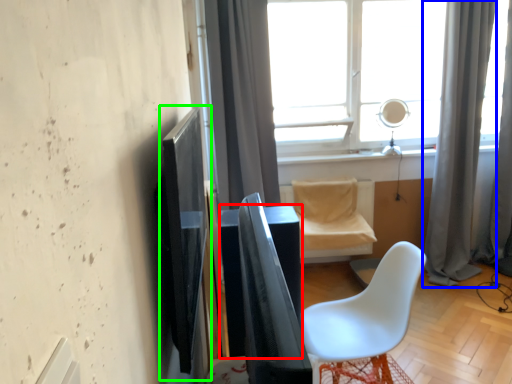
Question: Which is nearer to the table (highlighted by a red box)? curtain (highlighted by a blue box) or screen door (highlighted by a green box).

Choices:
 (A) curtain
 (B) screen door

Answer: (B)